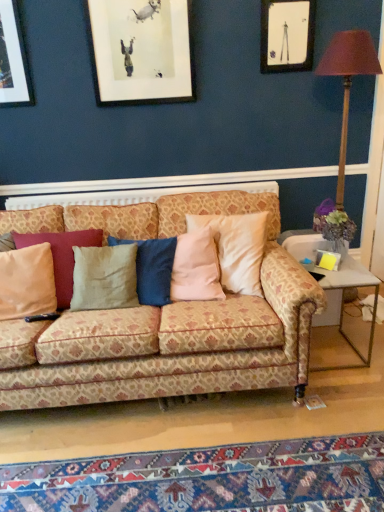
Identify the location of metallic gold table lamp at right. The width and height of the screenshot is (384, 512). (348, 80).

This screenshot has width=384, height=512. What do you see at coordinates (209, 478) in the screenshot?
I see `carpet with intricate patterns at lower center` at bounding box center [209, 478].

Describe the element at coordinates (167, 328) in the screenshot. I see `patterned fabric couch at center` at that location.

The height and width of the screenshot is (512, 384). Find the location of `metal/glass side table at lower right`. metal/glass side table at lower right is located at coordinates (343, 304).

Find the location of a particular element. The height and width of the screenshot is (512, 384). matte black picture frame at upper right is located at coordinates (287, 35).

In terms of width, does carpet with intricate patterns at lower center look wider or thinner when compared to metallic gold table lamp at right?

carpet with intricate patterns at lower center is thinner than metallic gold table lamp at right.

Is carpet with intricate patterns at lower center not within metallic gold table lamp at right?

Yes, carpet with intricate patterns at lower center is located beyond the bounds of metallic gold table lamp at right.

Looking at this image, from the image's perspective, is carpet with intricate patterns at lower center positioned above or below metallic gold table lamp at right?

carpet with intricate patterns at lower center is situated lower than metallic gold table lamp at right in the image.

Considering the sizes of carpet with intricate patterns at lower center and metallic gold table lamp at right in the image, is carpet with intricate patterns at lower center taller or shorter than metallic gold table lamp at right?

→ In the image, carpet with intricate patterns at lower center appears to be shorter than metallic gold table lamp at right.

Consider the image. Does carpet with intricate patterns at lower center have a greater height compared to patterned fabric couch at center?

Incorrect, the height of carpet with intricate patterns at lower center is not larger of that of patterned fabric couch at center.

Measure the distance from carpet with intricate patterns at lower center to patterned fabric couch at center.

A distance of 22.63 inches exists between carpet with intricate patterns at lower center and patterned fabric couch at center.

Is carpet with intricate patterns at lower center in contact with patterned fabric couch at center?

No, carpet with intricate patterns at lower center is not in contact with patterned fabric couch at center.

Which object is positioned more to the left, carpet with intricate patterns at lower center or patterned fabric couch at center?

patterned fabric couch at center is more to the left.

Based on the photo, how distant is metallic gold table lamp at right from matte black picture frame at upper right?

metallic gold table lamp at right is 14.21 inches from matte black picture frame at upper right.

Can you tell me how much metallic gold table lamp at right and matte black picture frame at upper right differ in facing direction?

The angle between the facing direction of metallic gold table lamp at right and the facing direction of matte black picture frame at upper right is 1.09 degrees.

Would you say matte black picture frame at upper right is part of metallic gold table lamp at right's contents?

No, matte black picture frame at upper right is not inside metallic gold table lamp at right.

From a real-world perspective, does metallic gold table lamp at right sit lower than matte black picture frame at upper right?

Yes.

From the image's perspective, is beige fabric pillow at left located beneath matte black picture frame at upper right?

Indeed, from the image's perspective, beige fabric pillow at left is shown beneath matte black picture frame at upper right.

Is beige fabric pillow at left facing towards matte black picture frame at upper right?

No.

Is beige fabric pillow at left with matte black picture frame at upper right?

beige fabric pillow at left and matte black picture frame at upper right are clearly separated.

From the image's perspective, which one is positioned lower, patterned fabric couch at center or metal/glass side table at lower right?

metal/glass side table at lower right appears lower in the image.

Is patterned fabric couch at center to the left of metal/glass side table at lower right from the viewer's perspective?

Yes, patterned fabric couch at center is to the left of metal/glass side table at lower right.

What's the angular difference between patterned fabric couch at center and metal/glass side table at lower right's facing directions?

The facing directions of patterned fabric couch at center and metal/glass side table at lower right are 0.843 degrees apart.

In terms of height, does patterned fabric couch at center look taller or shorter compared to metal/glass side table at lower right?

Considering their sizes, patterned fabric couch at center has more height than metal/glass side table at lower right.

In terms of height, does matte black picture frame at upper right look taller or shorter compared to beige fabric pillow at left?

Considering their sizes, matte black picture frame at upper right has less height than beige fabric pillow at left.

Which of these two, matte black picture frame at upper right or beige fabric pillow at left, is bigger?

With larger size is beige fabric pillow at left.

From the image's perspective, which one is positioned lower, matte black picture frame at upper right or beige fabric pillow at left?

beige fabric pillow at left.

Is point (308, 55) less distant than point (70, 240)?

That is False.

From a real-world perspective, is matte black picture frame at upper right physically located above or below carpet with intricate patterns at lower center?

matte black picture frame at upper right is above carpet with intricate patterns at lower center.

Considering the relative positions of matte black picture frame at upper right and carpet with intricate patterns at lower center in the image provided, is matte black picture frame at upper right in front of carpet with intricate patterns at lower center?

No, the depth of matte black picture frame at upper right is greater than that of carpet with intricate patterns at lower center.

Where is `mat below the matte black picture frame at upper right (from a real-world perspective)`? mat below the matte black picture frame at upper right (from a real-world perspective) is located at coordinates pyautogui.click(x=209, y=478).

Is point (289, 57) closer to viewer compared to point (221, 498)?

No, it is not.

At what (x,y) coordinates should I click in order to perform the action: click on mat below the metallic gold table lamp at right (from a real-world perspective). Please return your answer as a coordinate pair (x, y). Looking at the image, I should click on (209, 478).

Where is `studio couch located behind the carpet with intricate patterns at lower center`? studio couch located behind the carpet with intricate patterns at lower center is located at coordinates (167, 328).

When comparing their distances from metallic gold table lamp at right, does patterned fabric couch at center or beige fabric pillow at left seem further?

beige fabric pillow at left.

Estimate the real-world distances between objects in this image. Which object is closer to patterned fabric couch at center, metal/glass side table at lower right or matte black picture frame at upper right?

Among the two, metal/glass side table at lower right is located nearer to patterned fabric couch at center.

Looking at the image, which one is located further to metallic gold table lamp at right, carpet with intricate patterns at lower center or matte black picture frame at upper right?

Based on the image, carpet with intricate patterns at lower center appears to be further to metallic gold table lamp at right.

Which object lies nearer to the anchor point carpet with intricate patterns at lower center, beige fabric pillow at left or metal/glass side table at lower right?

metal/glass side table at lower right is closer to carpet with intricate patterns at lower center.

Based on their spatial positions, is matte black picture frame at upper right or carpet with intricate patterns at lower center closer to patterned fabric couch at center?

carpet with intricate patterns at lower center is positioned closer to the anchor patterned fabric couch at center.

When comparing their distances from beige fabric pillow at left, does matte black picture frame at upper right or metallic gold table lamp at right seem further?

Among the two, metallic gold table lamp at right is located further to beige fabric pillow at left.

Which object lies further to the anchor point metallic gold table lamp at right, patterned fabric couch at center or carpet with intricate patterns at lower center?

carpet with intricate patterns at lower center is positioned further to the anchor metallic gold table lamp at right.

Considering their positions, is beige fabric pillow at left positioned further to metallic gold table lamp at right than carpet with intricate patterns at lower center?

carpet with intricate patterns at lower center is positioned further to the anchor metallic gold table lamp at right.

This screenshot has height=512, width=384. Identify the location of studio couch between beige fabric pillow at left and metal/glass side table at lower right in the horizontal direction. (167, 328).

The width and height of the screenshot is (384, 512). Find the location of `pillow between matte black picture frame at upper right and patterned fabric couch at center vertically`. pillow between matte black picture frame at upper right and patterned fabric couch at center vertically is located at coordinates (62, 256).

Identify the location of mat between patterned fabric couch at center and metal/glass side table at lower right from left to right. (209, 478).

Find the location of a particular element. table situated between beige fabric pillow at left and metallic gold table lamp at right from left to right is located at coordinates (343, 304).